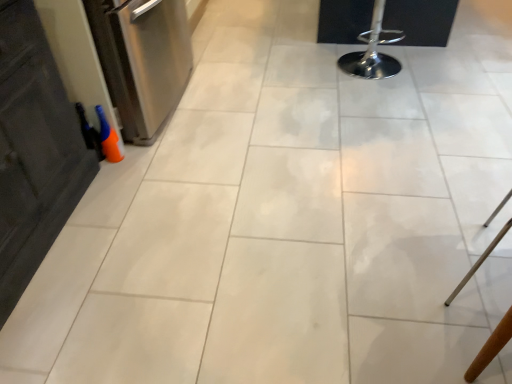
Locate an element on the screen. The width and height of the screenshot is (512, 384). spots to the right of stainless steel dishwasher at left is located at coordinates (264, 119).